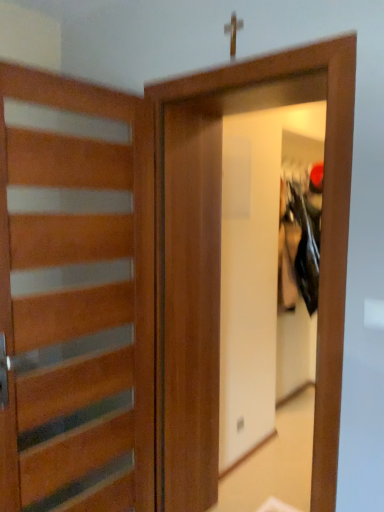
Question: Should I look upward or downward to see wooden door at left?

Choices:
 (A) up
 (B) down

Answer: (B)